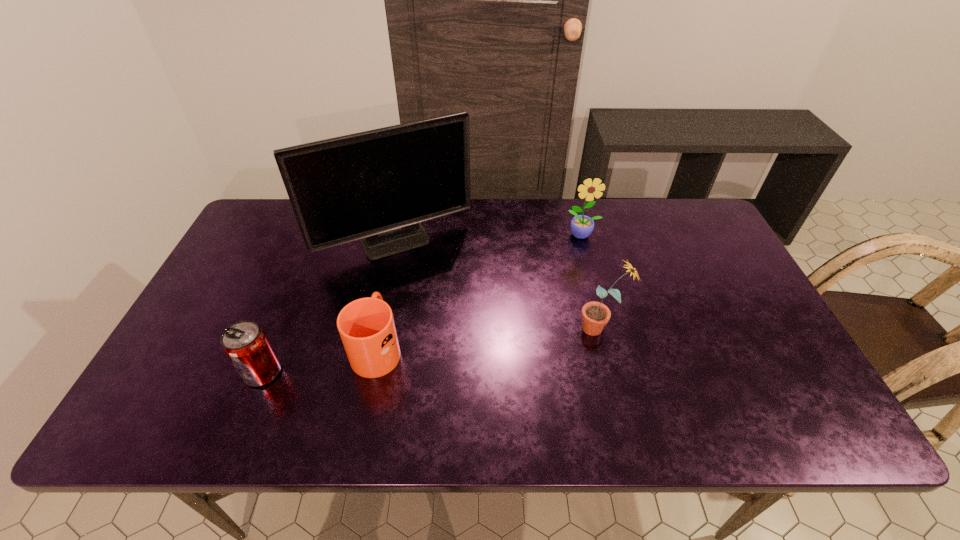
What are the coordinates of `free location at the far left corner of the desktop` in the screenshot? It's located at (273, 214).

At what (x,y) coordinates should I click in order to perform the action: click on vacant space at the far right corner. Please return your answer as a coordinate pair (x, y). The height and width of the screenshot is (540, 960). Looking at the image, I should click on (655, 213).

Locate an element on the screen. Image resolution: width=960 pixels, height=540 pixels. free space between the pop soda and the computer monitor is located at coordinates (329, 307).

The image size is (960, 540). In order to click on free spot between the tallest object and the mug in this screenshot , I will do `click(387, 295)`.

Identify the location of vacant space that is in between the mug and the pop soda. point(321,360).

Identify the location of free point between the tallest object and the pop soda. (329, 307).

Image resolution: width=960 pixels, height=540 pixels. I want to click on free space between the mug and the pop soda, so click(321, 360).

Where is `free space between the farther sunflower and the tallest object`? free space between the farther sunflower and the tallest object is located at coordinates (490, 239).

At what (x,y) coordinates should I click in order to perform the action: click on unoccupied position between the nearer sunflower and the pop soda. Please return your answer as a coordinate pair (x, y). The image size is (960, 540). Looking at the image, I should click on (431, 350).

Find the location of `free space between the nearer sunflower and the mug`. free space between the nearer sunflower and the mug is located at coordinates point(489,338).